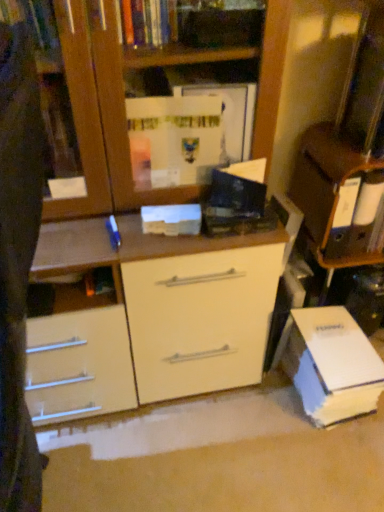
Question: Would you say white matte paperback book at center, arranged as the first paperback book when viewed from the front, is outside white glossy cabinet at upper right?

Choices:
 (A) no
 (B) yes

Answer: (B)

Question: Considering the relative sizes of white matte paperback book at center, the second paperback book in the right-to-left sequence, and white glossy cabinet at upper right in the image provided, is white matte paperback book at center, the second paperback book in the right-to-left sequence, smaller than white glossy cabinet at upper right?

Choices:
 (A) yes
 (B) no

Answer: (A)

Question: Can you confirm if white matte paperback book at center, positioned as the 2th paperback book in bottom-to-top order, is positioned to the right of white glossy cabinet at upper right?

Choices:
 (A) yes
 (B) no

Answer: (B)

Question: Can you confirm if white matte paperback book at center, the second paperback book in the right-to-left sequence, is shorter than white glossy cabinet at upper right?

Choices:
 (A) yes
 (B) no

Answer: (A)

Question: Is white matte paperback book at center, the second paperback book in the right-to-left sequence, positioned far away from white glossy cabinet at upper right?

Choices:
 (A) no
 (B) yes

Answer: (A)

Question: In terms of size, does white cardboard book at lower right, arranged as the 2th paperback book when viewed from the front, appear bigger or smaller than white glossy cabinet at upper right?

Choices:
 (A) small
 (B) big

Answer: (B)

Question: Is white cardboard book at lower right, which ranks as the 2th paperback book in top-to-bottom order, in front of or behind white glossy cabinet at upper right in the image?

Choices:
 (A) front
 (B) behind

Answer: (B)

Question: Considering the positions of point (311, 382) and point (314, 144), is point (311, 382) closer or farther from the camera than point (314, 144)?

Choices:
 (A) farther
 (B) closer

Answer: (A)

Question: Looking at their shapes, would you say white cardboard book at lower right, which ranks as the first paperback book in bottom-to-top order, is wider or thinner than white glossy cabinet at upper right?

Choices:
 (A) thin
 (B) wide

Answer: (B)

Question: Relative to white matte paperback book at center, placed as the first paperback book when sorted from left to right, is white cardboard book at lower right, which ranks as the 2th paperback book in top-to-bottom order, in front or behind?

Choices:
 (A) behind
 (B) front

Answer: (A)

Question: Is white cardboard book at lower right, which ranks as the 2th paperback book in top-to-bottom order, to the left or to the right of white matte paperback book at center, positioned as the 2th paperback book in bottom-to-top order, in the image?

Choices:
 (A) right
 (B) left

Answer: (A)

Question: Is white cardboard book at lower right, which ranks as the first paperback book in bottom-to-top order, situated inside white matte paperback book at center, arranged as the first paperback book when viewed from the front, or outside?

Choices:
 (A) outside
 (B) inside

Answer: (A)

Question: Is point (292, 314) closer or farther from the camera than point (162, 216)?

Choices:
 (A) farther
 (B) closer

Answer: (A)

Question: Is white glossy cabinet at upper right to the left or to the right of white cardboard book at lower right, which ranks as the first paperback book in bottom-to-top order, in the image?

Choices:
 (A) left
 (B) right

Answer: (B)

Question: In terms of size, does white glossy cabinet at upper right appear bigger or smaller than white cardboard book at lower right, arranged as the 2th paperback book when viewed from the front?

Choices:
 (A) small
 (B) big

Answer: (A)